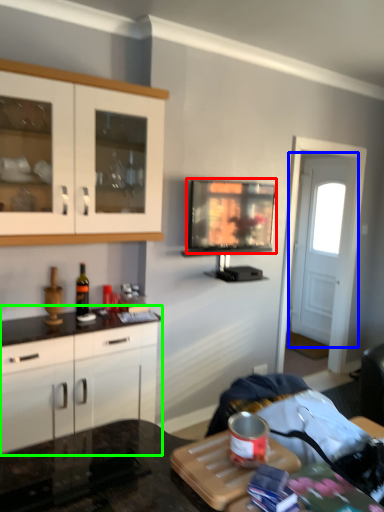
Question: Estimate the real-world distances between objects in this image. Which object is farther from television (highlighted by a red box), door (highlighted by a blue box) or cabinetry (highlighted by a green box)?

Choices:
 (A) door
 (B) cabinetry

Answer: (A)